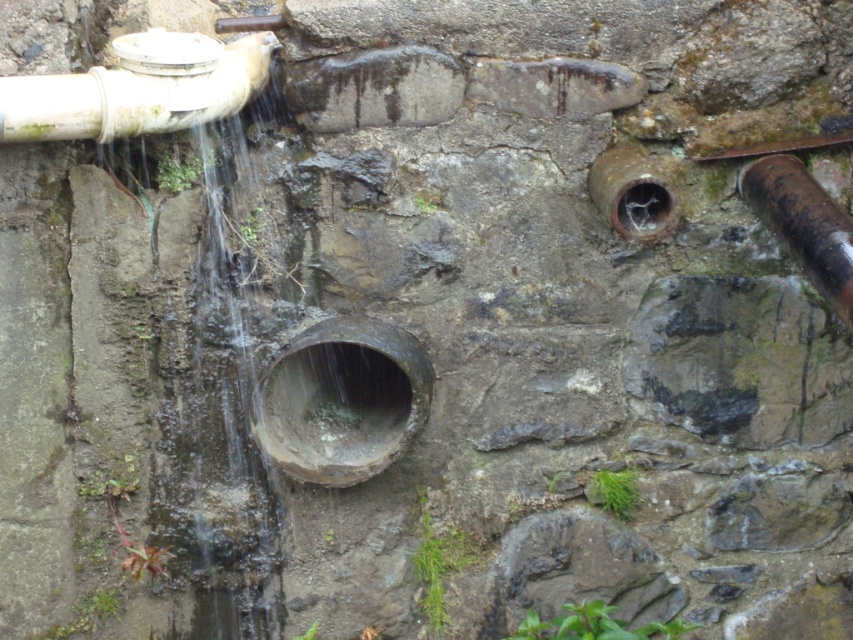
Does point (267, 385) come farther from viewer compared to point (132, 113)?

Yes, it is.

Is point (402, 428) closer to camera compared to point (27, 86)?

No, (402, 428) is behind (27, 86).

Locate an element on the screen. Image resolution: width=853 pixels, height=640 pixels. rusty metal pipe at center is located at coordinates (341, 401).

Does point (236, 38) come farther from viewer compared to point (817, 269)?

That is True.

Between white matte water pipe at upper left and rusty metal pipe at right, which one is positioned higher?

white matte water pipe at upper left is higher up.

Who is more distant from viewer, [225,61] or [740,184]?

The point [740,184] is behind.

Identify the location of white matte water pipe at upper left. (138, 88).

Does rusty metal pipe at center have a lesser width compared to rusty metal pipe at right?

Incorrect, rusty metal pipe at center's width is not less than rusty metal pipe at right's.

Can you confirm if rusty metal pipe at center is smaller than rusty metal pipe at right?

No, rusty metal pipe at center is not smaller than rusty metal pipe at right.

Does point (341, 400) come in front of point (790, 220)?

No, it is not.

This screenshot has height=640, width=853. In order to click on rusty metal pipe at center in this screenshot , I will do `click(341, 401)`.